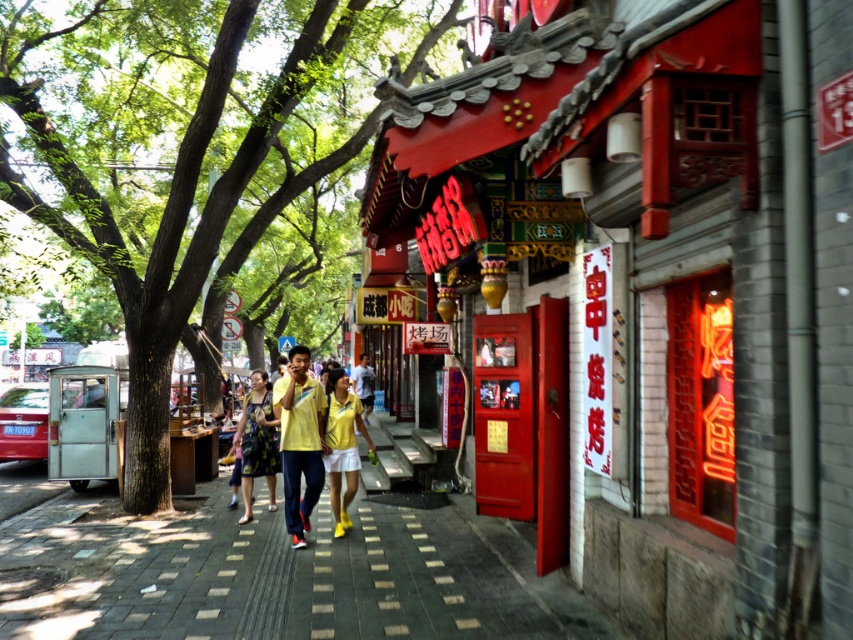
Does green leafy tree at left have a greater width compared to yellow fabric pants at center?

Yes.

In the scene shown: Does green leafy tree at left have a smaller size compared to yellow fabric pants at center?

No.

Who is more distant from viewer, (372, 116) or (316, 422)?

The point (372, 116) is more distant.

Image resolution: width=853 pixels, height=640 pixels. What are the coordinates of `green leafy tree at left` in the screenshot? It's located at tap(177, 157).

Where is `yellow fabric pants at center`? Image resolution: width=853 pixels, height=640 pixels. yellow fabric pants at center is located at coordinates (299, 440).

Which is more to the left, yellow fabric pants at center or printed fabric dress at center?

Positioned to the left is printed fabric dress at center.

The width and height of the screenshot is (853, 640). What do you see at coordinates (299, 440) in the screenshot? I see `yellow fabric pants at center` at bounding box center [299, 440].

Locate an element on the screen. This screenshot has width=853, height=640. yellow fabric pants at center is located at coordinates (299, 440).

Is yellow fabric shirt at center above printed fabric dress at center?

Correct, yellow fabric shirt at center is located above printed fabric dress at center.

Is yellow fabric shirt at center in front of printed fabric dress at center?

Yes.

Which is in front, point (341, 493) or point (252, 413)?

Positioned in front is point (252, 413).

Identify the location of yellow fabric shirt at center. This screenshot has height=640, width=853. (341, 444).